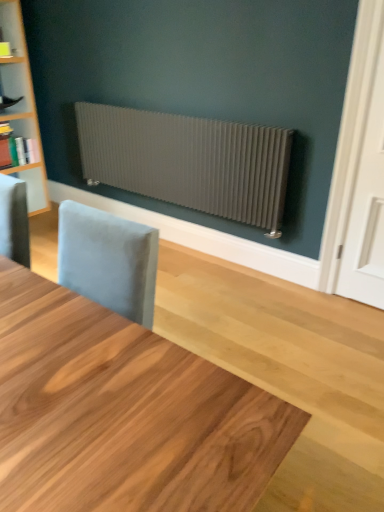
Question: Is matte white bookshelf at left with light wood table at center?

Choices:
 (A) no
 (B) yes

Answer: (A)

Question: Is matte white bookshelf at left further to camera compared to light wood table at center?

Choices:
 (A) no
 (B) yes

Answer: (B)

Question: Is matte white bookshelf at left positioned before light wood table at center?

Choices:
 (A) yes
 (B) no

Answer: (B)

Question: Can you confirm if matte white bookshelf at left is positioned to the right of light wood table at center?

Choices:
 (A) yes
 (B) no

Answer: (B)

Question: Considering the relative sizes of matte white bookshelf at left and light wood table at center in the image provided, is matte white bookshelf at left wider than light wood table at center?

Choices:
 (A) yes
 (B) no

Answer: (B)

Question: From the image's perspective, does matte white bookshelf at left appear lower than light wood table at center?

Choices:
 (A) yes
 (B) no

Answer: (B)

Question: Could you tell me if matte white bookshelf at left is turned towards satin silver radiator at upper center?

Choices:
 (A) no
 (B) yes

Answer: (B)

Question: Is matte white bookshelf at left closer to the viewer compared to satin silver radiator at upper center?

Choices:
 (A) yes
 (B) no

Answer: (B)

Question: Can you confirm if matte white bookshelf at left is wider than satin silver radiator at upper center?

Choices:
 (A) yes
 (B) no

Answer: (A)

Question: Does matte white bookshelf at left appear on the left side of satin silver radiator at upper center?

Choices:
 (A) yes
 (B) no

Answer: (A)

Question: Is matte white bookshelf at left at the right side of satin silver radiator at upper center?

Choices:
 (A) no
 (B) yes

Answer: (A)

Question: Is matte white bookshelf at left far from satin silver radiator at upper center?

Choices:
 (A) yes
 (B) no

Answer: (A)

Question: Is light wood table at center positioned with its back to matte white bookshelf at left?

Choices:
 (A) yes
 (B) no

Answer: (B)